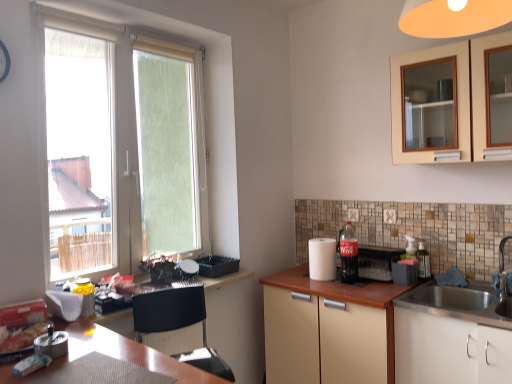
Question: In the image, is white paper towel at center, which appears as the 1th appliance when viewed from the left, on the left side or the right side of red glass coca-cola bottle at center-right?

Choices:
 (A) right
 (B) left

Answer: (B)

Question: Looking at the image, does white paper towel at center, which appears as the 1th appliance when viewed from the left, seem bigger or smaller compared to red glass coca-cola bottle at center-right?

Choices:
 (A) small
 (B) big

Answer: (B)

Question: Which object is positioned closest to the beige matte cabinet at center, the 1th cabinetry positioned from the left?

Choices:
 (A) transparent plastic bottle at right
 (B) white paper towel at center, which appears as the 1th appliance when viewed from the left
 (C) white glossy sink at lower right, marked as the first cabinetry in a right-to-left arrangement
 (D) black plastic soda at center, marked as the 2th appliance in a left-to-right arrangement
 (E) wooden at left

Answer: (C)

Question: Estimate the real-world distances between objects in this image. Which object is farther from the white paper towel at center, which appears as the second appliance when viewed from the right?

Choices:
 (A) wooden at left
 (B) white plastic window at left
 (C) transparent plastic bottle at right
 (D) black plastic chair at lower left
 (E) white glossy sink at lower right, marked as the second cabinetry in a left-to-right arrangement

Answer: (B)